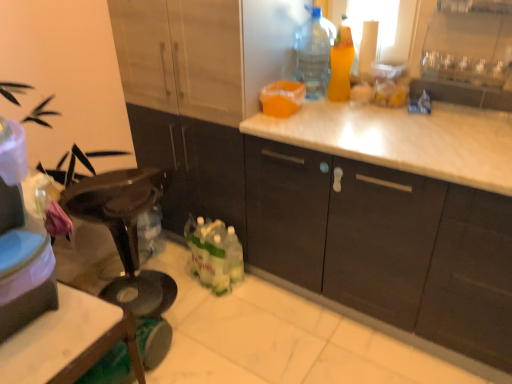
Describe the element at coordinates (314, 54) in the screenshot. I see `transparent plastic bottle at upper right, the 2th bottle positioned from the right` at that location.

This screenshot has height=384, width=512. Find the location of `translucent orange spray bottle at upper right, marked as the second bottle in a left-to-right arrangement`. translucent orange spray bottle at upper right, marked as the second bottle in a left-to-right arrangement is located at coordinates (341, 65).

The height and width of the screenshot is (384, 512). Describe the element at coordinates (341, 65) in the screenshot. I see `translucent orange spray bottle at upper right, marked as the second bottle in a left-to-right arrangement` at that location.

I want to click on transparent plastic bottle at upper right, the 1th bottle from the left, so click(314, 54).

From a real-world perspective, is transparent plastic bottle at upper right, the 1th bottle from the left, located beneath matte wood cabinets at center?

No, from a real-world perspective, transparent plastic bottle at upper right, the 1th bottle from the left, is not under matte wood cabinets at center.

Between point (311, 79) and point (385, 271), which one is positioned behind?

The point (311, 79) is farther from the camera.

Would you say transparent plastic bottle at upper right, the 1th bottle from the left, is outside matte wood cabinets at center?

That's correct, transparent plastic bottle at upper right, the 1th bottle from the left, is outside of matte wood cabinets at center.

From the image's perspective, does translucent orange spray bottle at upper right, marked as the 1th bottle in a right-to-left arrangement, appear higher than transparent plastic bottle at upper right, the 1th bottle from the left?

No, from the image's perspective, translucent orange spray bottle at upper right, marked as the 1th bottle in a right-to-left arrangement, is not over transparent plastic bottle at upper right, the 1th bottle from the left.

This screenshot has height=384, width=512. I want to click on bottle on the left of translucent orange spray bottle at upper right, marked as the 1th bottle in a right-to-left arrangement, so pos(314,54).

Is translucent orange spray bottle at upper right, marked as the second bottle in a left-to-right arrangement, smaller than transparent plastic bottle at upper right, the 2th bottle positioned from the right?

Correct, translucent orange spray bottle at upper right, marked as the second bottle in a left-to-right arrangement, occupies less space than transparent plastic bottle at upper right, the 2th bottle positioned from the right.

Is translucent orange spray bottle at upper right, marked as the 1th bottle in a right-to-left arrangement, thinner than transparent plastic bottle at upper right, the 2th bottle positioned from the right?

Yes.

Does matte wood cabinets at center lie behind matte plastic container at left?

Yes, it is behind matte plastic container at left.

From a real-world perspective, is matte wood cabinets at center physically located above or below matte plastic container at left?

Clearly, from a real-world perspective, matte wood cabinets at center is below matte plastic container at left.

Does matte wood cabinets at center appear on the left side of matte plastic container at left?

Incorrect, matte wood cabinets at center is not on the left side of matte plastic container at left.

Could you tell me if matte wood cabinets at center is turned towards matte plastic container at left?

Yes.

From a real-world perspective, is translucent orange spray bottle at upper right, marked as the 1th bottle in a right-to-left arrangement, below matte plastic container at left?

No, from a real-world perspective, translucent orange spray bottle at upper right, marked as the 1th bottle in a right-to-left arrangement, is not beneath matte plastic container at left.

Considering the relative positions of translucent orange spray bottle at upper right, marked as the 1th bottle in a right-to-left arrangement, and matte plastic container at left in the image provided, is translucent orange spray bottle at upper right, marked as the 1th bottle in a right-to-left arrangement, in front of matte plastic container at left?

No, translucent orange spray bottle at upper right, marked as the 1th bottle in a right-to-left arrangement, is further to the viewer.

Can you confirm if translucent orange spray bottle at upper right, marked as the 1th bottle in a right-to-left arrangement, is thinner than matte plastic container at left?

Yes, translucent orange spray bottle at upper right, marked as the 1th bottle in a right-to-left arrangement, is thinner than matte plastic container at left.

The height and width of the screenshot is (384, 512). I want to click on appliance directly beneath the translucent orange spray bottle at upper right, marked as the second bottle in a left-to-right arrangement (from a real-world perspective), so click(x=21, y=243).

From a real-world perspective, which is physically above, matte plastic container at left or translucent orange spray bottle at upper right, marked as the 1th bottle in a right-to-left arrangement?

translucent orange spray bottle at upper right, marked as the 1th bottle in a right-to-left arrangement.

Is point (22, 235) closer to viewer compared to point (336, 97)?

Yes, it is in front of point (336, 97).

From the picture: From the image's perspective, is matte plastic container at left above or below translucent orange spray bottle at upper right, marked as the second bottle in a left-to-right arrangement?

Based on their image positions, matte plastic container at left is located beneath translucent orange spray bottle at upper right, marked as the second bottle in a left-to-right arrangement.

Is matte plastic container at left smaller than translucent orange spray bottle at upper right, marked as the 1th bottle in a right-to-left arrangement?

Incorrect, matte plastic container at left is not smaller in size than translucent orange spray bottle at upper right, marked as the 1th bottle in a right-to-left arrangement.

Can you confirm if matte plastic container at left is bigger than matte wood cabinets at center?

Incorrect, matte plastic container at left is not larger than matte wood cabinets at center.

Identify the location of appliance on the left of the matte wood cabinets at center. (x=21, y=243).

Does matte plastic container at left have a lesser height compared to matte wood cabinets at center?

Correct, matte plastic container at left is not as tall as matte wood cabinets at center.

Which object is thinner, matte plastic container at left or matte wood cabinets at center?

Thinner between the two is matte plastic container at left.

Are matte wood cabinets at center and transparent plastic bottle at upper right, the 2th bottle positioned from the right, far apart?

Actually, matte wood cabinets at center and transparent plastic bottle at upper right, the 2th bottle positioned from the right, are a little close together.

From the picture: Considering the sizes of objects matte wood cabinets at center and transparent plastic bottle at upper right, the 2th bottle positioned from the right, in the image provided, who is taller, matte wood cabinets at center or transparent plastic bottle at upper right, the 2th bottle positioned from the right,?

matte wood cabinets at center is taller.

Is point (274, 258) positioned behind point (330, 70)?

Yes, it is.

This screenshot has height=384, width=512. Identify the location of cabinetry located on the right of transparent plastic bottle at upper right, the 1th bottle from the left. (386, 244).

The image size is (512, 384). What are the coordinates of `bottle that is below the transparent plastic bottle at upper right, the 1th bottle from the left (from the image's perspective)` in the screenshot? It's located at (341, 65).

Based on the photo, based on their spatial positions, is translucent orange spray bottle at upper right, marked as the 1th bottle in a right-to-left arrangement, or matte plastic container at left closer to matte wood cabinets at center?

translucent orange spray bottle at upper right, marked as the 1th bottle in a right-to-left arrangement, is positioned closer to the anchor matte wood cabinets at center.

Considering their positions, is matte plastic container at left positioned closer to matte wood cabinets at center than transparent plastic bottle at upper right, the 1th bottle from the left?

transparent plastic bottle at upper right, the 1th bottle from the left.

Looking at the image, which one is located closer to matte plastic container at left, transparent plastic bottle at upper right, the 2th bottle positioned from the right, or matte wood cabinets at center?

Based on the image, matte wood cabinets at center appears to be nearer to matte plastic container at left.

When comparing their distances from translucent orange spray bottle at upper right, marked as the 1th bottle in a right-to-left arrangement, does matte plastic container at left or matte wood cabinets at center seem closer?

The object closer to translucent orange spray bottle at upper right, marked as the 1th bottle in a right-to-left arrangement, is matte wood cabinets at center.

Considering their positions, is matte wood cabinets at center positioned closer to matte plastic container at left than transparent plastic bottle at upper right, the 2th bottle positioned from the right?

matte wood cabinets at center is closer to matte plastic container at left.

From the image, which object appears to be nearer to transparent plastic bottle at upper right, the 1th bottle from the left, translucent orange spray bottle at upper right, marked as the second bottle in a left-to-right arrangement, or matte wood cabinets at center?

translucent orange spray bottle at upper right, marked as the second bottle in a left-to-right arrangement.

Looking at the image, which one is located closer to translucent orange spray bottle at upper right, marked as the 1th bottle in a right-to-left arrangement, transparent plastic bottle at upper right, the 2th bottle positioned from the right, or matte wood cabinets at center?

transparent plastic bottle at upper right, the 2th bottle positioned from the right, is positioned closer to the anchor translucent orange spray bottle at upper right, marked as the 1th bottle in a right-to-left arrangement.

Which object lies nearer to the anchor point transparent plastic bottle at upper right, the 1th bottle from the left, matte wood cabinets at center or translucent orange spray bottle at upper right, marked as the second bottle in a left-to-right arrangement?

translucent orange spray bottle at upper right, marked as the second bottle in a left-to-right arrangement, is positioned closer to the anchor transparent plastic bottle at upper right, the 1th bottle from the left.

Locate an element on the screen. This screenshot has height=384, width=512. bottle that lies between transparent plastic bottle at upper right, the 1th bottle from the left, and matte wood cabinets at center from top to bottom is located at coordinates (341, 65).

Locate an element on the screen. The height and width of the screenshot is (384, 512). bottle located between matte plastic container at left and translucent orange spray bottle at upper right, marked as the second bottle in a left-to-right arrangement, in the left-right direction is located at coordinates (314, 54).